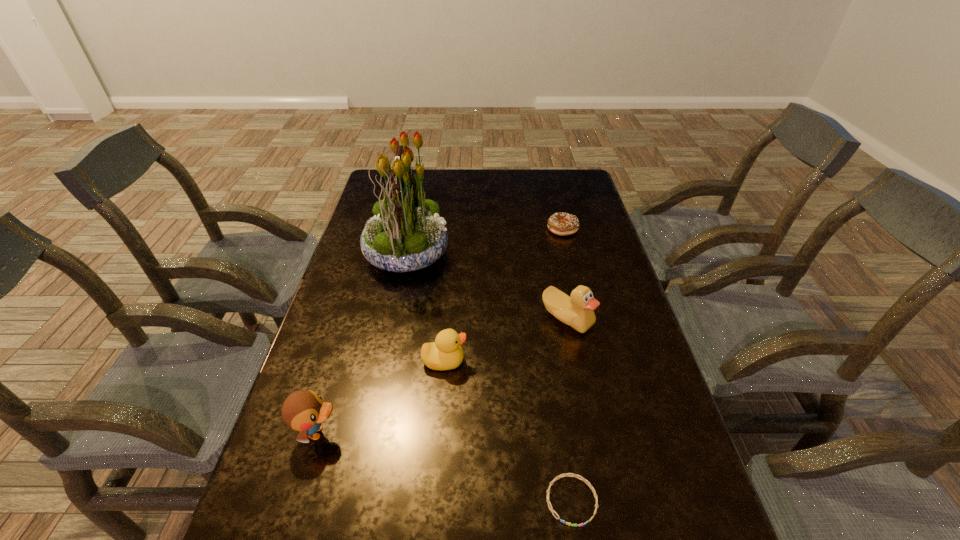
I want to click on the tallest object, so click(406, 234).

Identify the location of the rightmost duck. The image size is (960, 540). (577, 311).

Where is `the third farthest object`? The width and height of the screenshot is (960, 540). the third farthest object is located at coordinates (577, 311).

The height and width of the screenshot is (540, 960). Identify the location of the fifth farthest object. (304, 410).

Find the location of a particular element. This screenshot has height=540, width=960. the leftmost duck is located at coordinates (304, 410).

At what (x,y) coordinates should I click in order to perform the action: click on the third nearest object. Please return your answer as a coordinate pair (x, y). This screenshot has width=960, height=540. Looking at the image, I should click on (445, 353).

This screenshot has height=540, width=960. I want to click on the second nearest duck, so click(x=445, y=353).

Where is `the fifth tallest object`? The width and height of the screenshot is (960, 540). the fifth tallest object is located at coordinates (560, 223).

This screenshot has height=540, width=960. In order to click on the shortest object in this screenshot , I will do `click(565, 474)`.

Identify the location of bracelet. This screenshot has width=960, height=540. (565, 474).